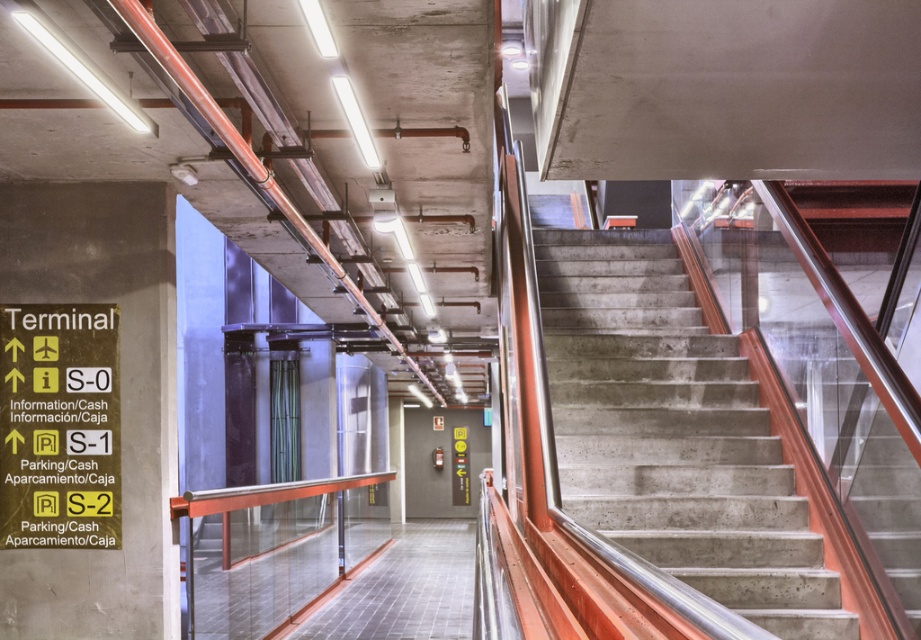
Question: Does concrete/stained stairs at center come behind clear glass railing at center?

Choices:
 (A) no
 (B) yes

Answer: (A)

Question: Is concrete/stained stairs at center above clear glass railing at center?

Choices:
 (A) no
 (B) yes

Answer: (B)

Question: Is concrete/stained stairs at center above clear glass railing at center?

Choices:
 (A) yes
 (B) no

Answer: (A)

Question: Which object is closer to the camera taking this photo?

Choices:
 (A) concrete/stained stairs at center
 (B) clear glass railing at center

Answer: (A)